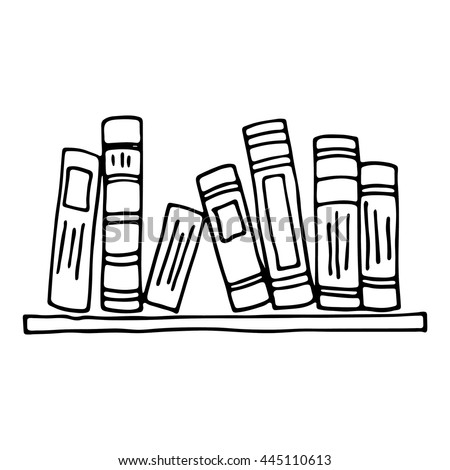
At what (x,y) coordinates should I click in order to perform the action: click on book. Please return your answer as a coordinate pair (x, y). The height and width of the screenshot is (470, 450). Looking at the image, I should click on (81, 271), (117, 277), (166, 269), (229, 269), (273, 250), (319, 243), (370, 246).